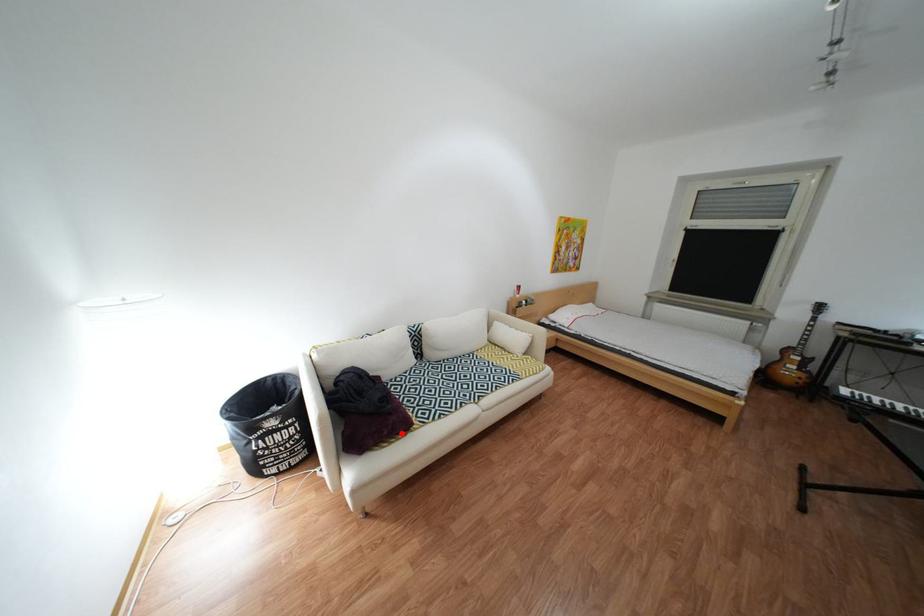
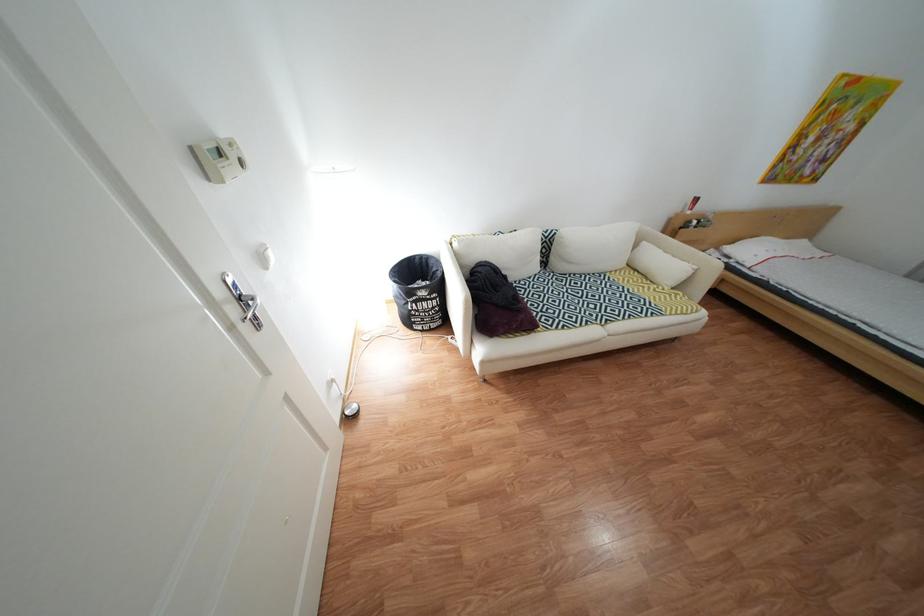
Question: I am providing you with two images of the same scene from different viewpoints. In image1, a red point is highlighted. Considering the same 3D point in image2, which of the following is correct?

Choices:
 (A) It is closer
 (B) It is farther

Answer: (B)